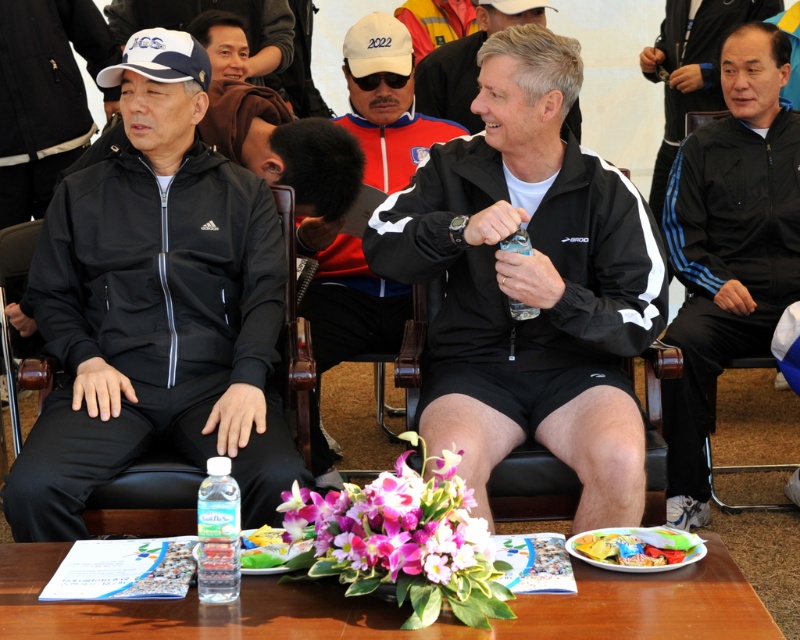
Question: Which point is farther to the camera?

Choices:
 (A) purple silk orchid at center
 (B) red jacket at center

Answer: (B)

Question: Considering the relative positions of red jacket at center and multicolored plastic bag at lower center in the image provided, where is red jacket at center located with respect to multicolored plastic bag at lower center?

Choices:
 (A) below
 (B) above

Answer: (B)

Question: Is black synthetic jacket at right to the left of clear plastic bottle at lower center from the viewer's perspective?

Choices:
 (A) no
 (B) yes

Answer: (A)

Question: Which object appears closest to the camera in this image?

Choices:
 (A) brown leather chair at center
 (B) gray matte jacket at center
 (C) black matte jacket at left
 (D) black leather chair at center

Answer: (C)

Question: From the image, what is the correct spatial relationship of brown leather chair at center in relation to clear plastic bottle at center?

Choices:
 (A) left
 (B) right

Answer: (A)

Question: Which point is closer to the camera?

Choices:
 (A) (405, 422)
 (B) (200, 540)

Answer: (B)